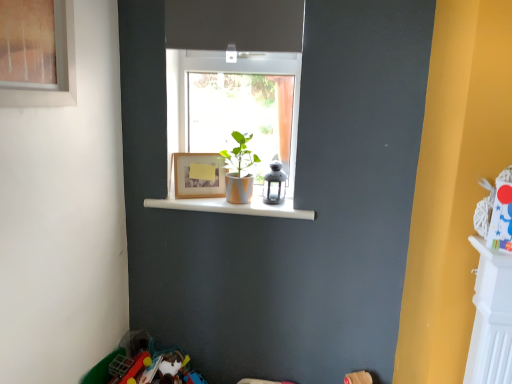
Question: From a real-world perspective, is white glossy shelf at center positioned over wooden frame at center based on gravity?

Choices:
 (A) no
 (B) yes

Answer: (A)

Question: From a real-world perspective, is white glossy shelf at center positioned under wooden frame at center based on gravity?

Choices:
 (A) no
 (B) yes

Answer: (B)

Question: Is the surface of white glossy shelf at center in direct contact with wooden frame at center?

Choices:
 (A) yes
 (B) no

Answer: (B)

Question: Does white glossy shelf at center have a greater height compared to wooden frame at center?

Choices:
 (A) yes
 (B) no

Answer: (B)

Question: From the image's perspective, is white glossy shelf at center below wooden frame at center?

Choices:
 (A) yes
 (B) no

Answer: (A)

Question: From the image's perspective, relative to wooden frame at center, is matte black lantern at upper center above or below?

Choices:
 (A) below
 (B) above

Answer: (A)

Question: Does point (272, 183) appear closer or farther from the camera than point (206, 185)?

Choices:
 (A) farther
 (B) closer

Answer: (B)

Question: Based on their sizes in the image, would you say matte black lantern at upper center is bigger or smaller than wooden frame at center?

Choices:
 (A) big
 (B) small

Answer: (B)

Question: Relative to wooden frame at center, is matte black lantern at upper center in front or behind?

Choices:
 (A) front
 (B) behind

Answer: (A)

Question: In the image, is matte black lantern at upper center positioned in front of or behind white glossy shelf at center?

Choices:
 (A) behind
 (B) front

Answer: (A)

Question: Looking at the image, does matte black lantern at upper center seem bigger or smaller compared to white glossy shelf at center?

Choices:
 (A) small
 (B) big

Answer: (A)

Question: From a real-world perspective, relative to white glossy shelf at center, is matte black lantern at upper center vertically above or below?

Choices:
 (A) below
 (B) above

Answer: (B)

Question: From the image's perspective, is matte black lantern at upper center positioned above or below white glossy shelf at center?

Choices:
 (A) below
 (B) above

Answer: (B)

Question: From a real-world perspective, is white glossy shelf at center above or below matte orange pot at center?

Choices:
 (A) above
 (B) below

Answer: (B)

Question: In the image, is white glossy shelf at center on the left side or the right side of matte orange pot at center?

Choices:
 (A) right
 (B) left

Answer: (B)